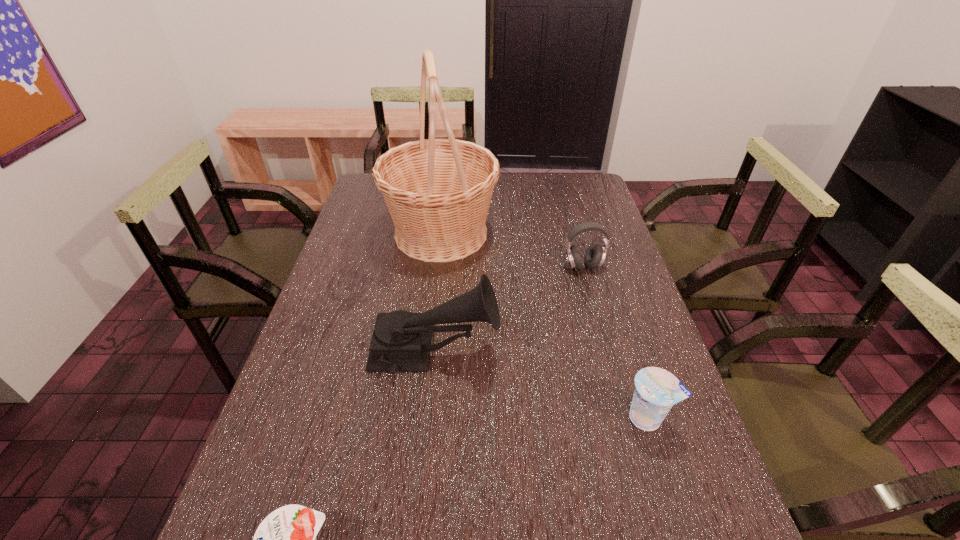
Where is `object present at the far edge`? The width and height of the screenshot is (960, 540). object present at the far edge is located at coordinates (438, 191).

Locate an element on the screen. This screenshot has height=540, width=960. object at the left edge is located at coordinates (438, 191).

Identify the location of headset that is at the right edge. (595, 254).

Find the location of a particular element. The height and width of the screenshot is (540, 960). yogurt at the right edge is located at coordinates (657, 390).

The image size is (960, 540). Find the location of `object that is positioned at the far left corner`. object that is positioned at the far left corner is located at coordinates (438, 191).

Identify the location of free space at the far edge of the desktop. (506, 201).

I want to click on vacant space at the left edge, so click(289, 475).

Where is `free space at the right edge of the desktop`? The image size is (960, 540). free space at the right edge of the desktop is located at coordinates (573, 211).

Locate an element on the screen. The image size is (960, 540). free space at the far right corner of the desktop is located at coordinates click(x=588, y=204).

In order to click on free space between the phonograph_record and the third shortest object in this screenshot , I will do `click(509, 309)`.